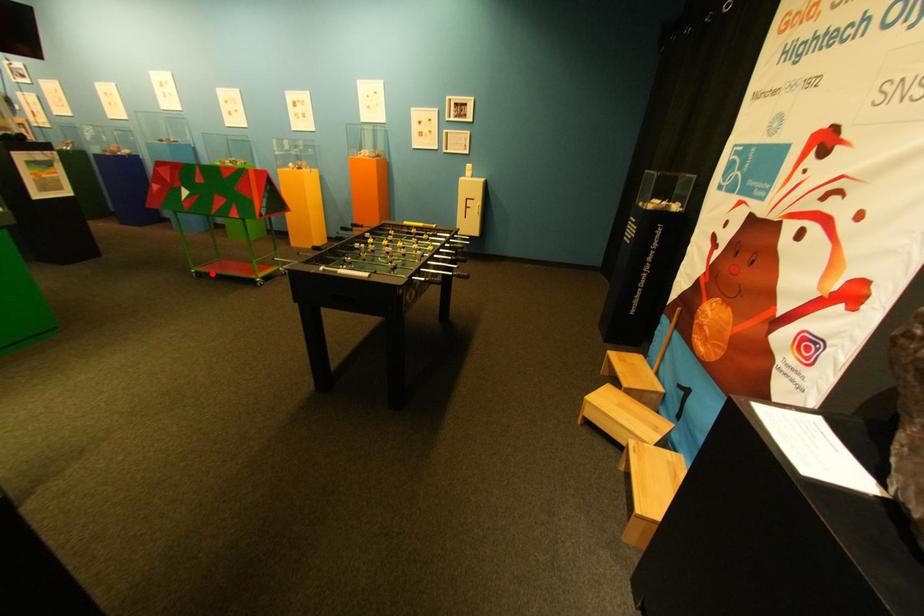
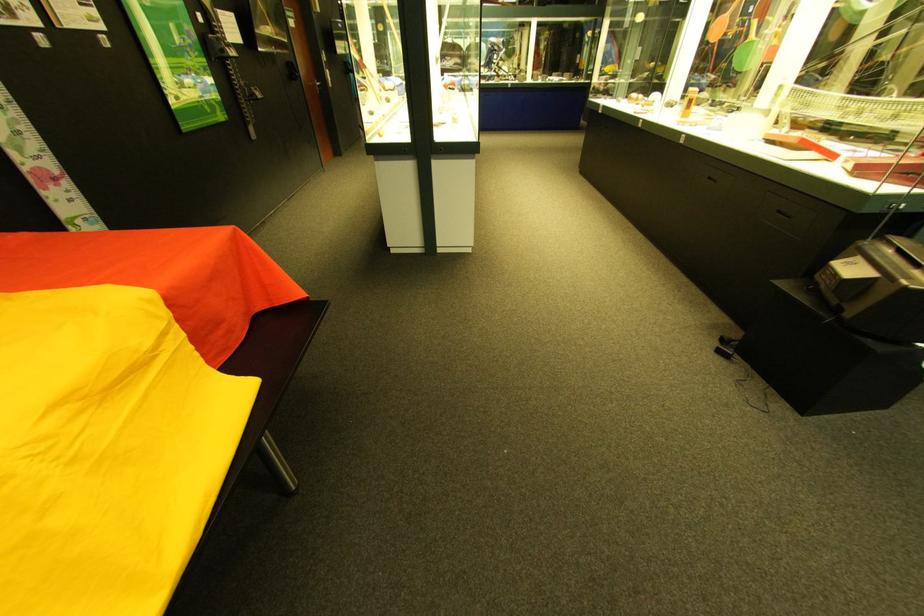
Question: I am providing you with two images of the same scene from different viewpoints. A red point is marked on the first image. Can you still see the location of the red point in image 2?

Choices:
 (A) Yes
 (B) No

Answer: (B)